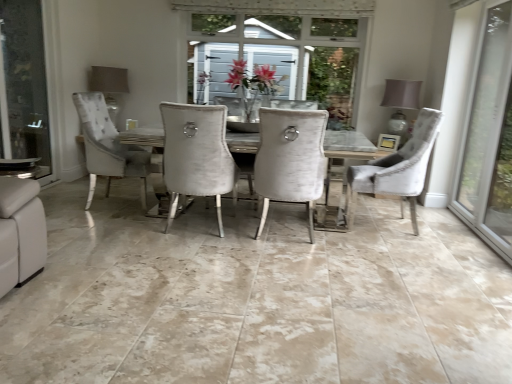
Question: Looking at the image, does transparent glass door at right seem bigger or smaller compared to matte gray lampshade at upper left, which is counted as the 1th lamp, starting from the left?

Choices:
 (A) big
 (B) small

Answer: (A)

Question: Based on their positions, is transparent glass door at right located to the left or right of matte gray lampshade at upper left, which is counted as the 1th lamp, starting from the left?

Choices:
 (A) left
 (B) right

Answer: (B)

Question: Which is farther from the velvet white chair at center, the second chair in the right-to-left sequence?

Choices:
 (A) velvet grey chair at right, which appears as the second chair when viewed from the left
 (B) clear glass screen door at left
 (C) matte gray lampshade at upper right, the second lamp when ordered from left to right
 (D) transparent glass door at right
 (E) matte gray lampshade at upper left, marked as the 2th lamp in a right-to-left arrangement

Answer: (E)

Question: Which is nearer to the clear glass screen door at left?

Choices:
 (A) matte gray lampshade at upper left, marked as the 2th lamp in a right-to-left arrangement
 (B) velvet white chair at center, placed as the first chair when sorted from left to right
 (C) transparent glass door at right
 (D) velvet grey chair at right, the 1th chair in the right-to-left sequence
 (E) matte gray lampshade at upper right, the second lamp when ordered from left to right

Answer: (A)